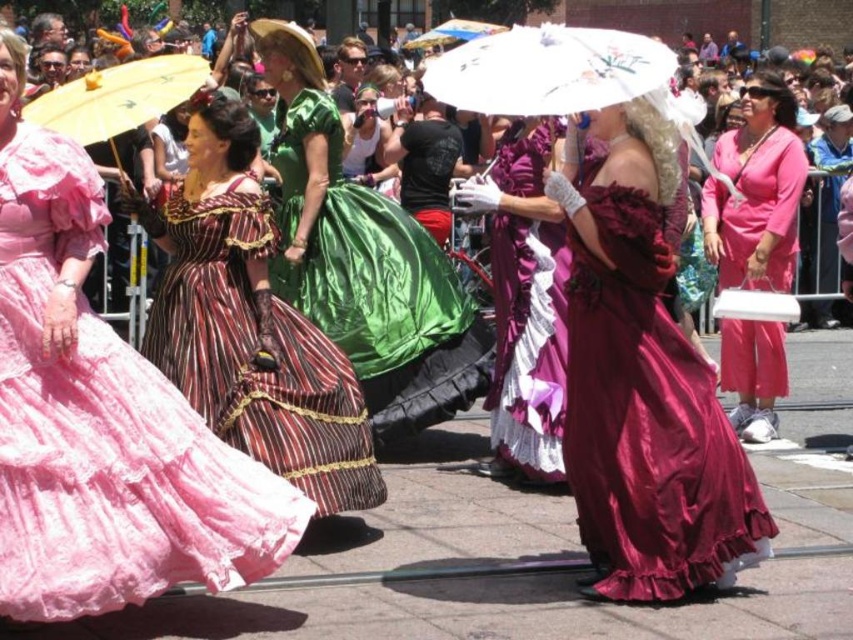
Question: Does striped satin dress at center appear under white paper umbrella at upper center?

Choices:
 (A) no
 (B) yes

Answer: (B)

Question: Based on their relative distances, which object is farther from the striped satin dress at center?

Choices:
 (A) pink satin purse at right
 (B) pink satin dress at left
 (C) green satin dress at center

Answer: (A)

Question: Among these objects, which one is farthest from the camera?

Choices:
 (A) striped satin dress at center
 (B) purple satin dress at center
 (C) white paper umbrella at upper center

Answer: (B)

Question: Can you confirm if striped satin dress at center is smaller than green satin dress at center?

Choices:
 (A) no
 (B) yes

Answer: (B)

Question: Which object is positioned farthest from the pink satin dress at left?

Choices:
 (A) pink satin purse at right
 (B) green satin dress at center
 (C) striped satin dress at center

Answer: (A)

Question: Is pink satin purse at right wider than white paper umbrella at upper center?

Choices:
 (A) yes
 (B) no

Answer: (B)